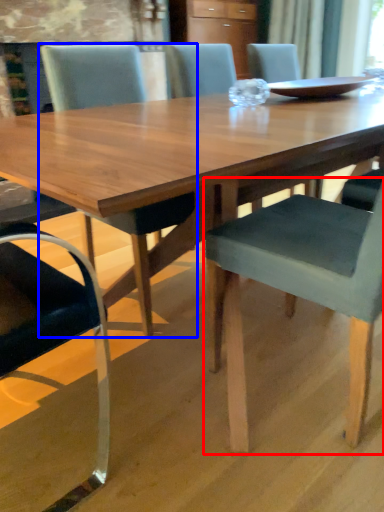
Question: Which object appears closest to the camera in this image, chair (highlighted by a red box) or chair (highlighted by a blue box)?

Choices:
 (A) chair
 (B) chair

Answer: (A)